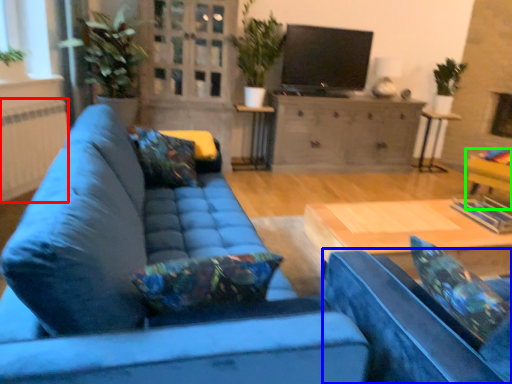
Question: Which object is the closest to the radiator (highlighted by a red box)? Choose among these: armchair (highlighted by a blue box) or armchair (highlighted by a green box).

Choices:
 (A) armchair
 (B) armchair

Answer: (A)